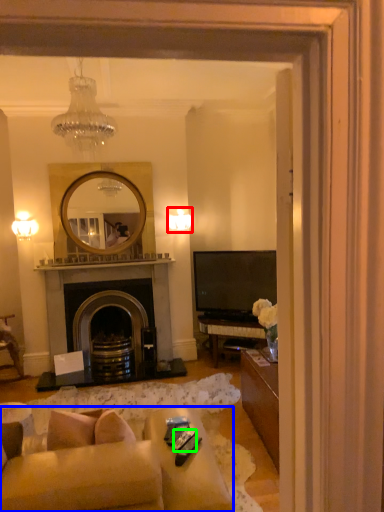
Question: Estimate the real-world distances between objects in this image. Which object is closer to lamp (highlighted by a red box), studio couch (highlighted by a blue box) or remote control (highlighted by a green box)?

Choices:
 (A) studio couch
 (B) remote control

Answer: (B)